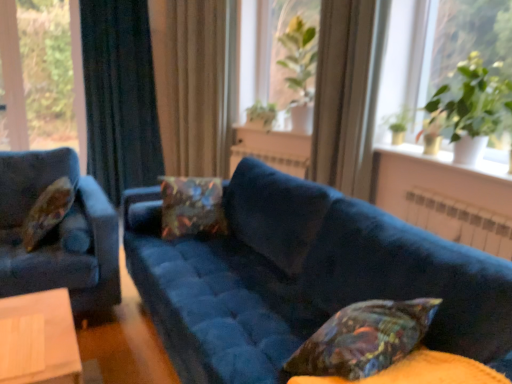
Question: Can we say green leafy plant at upper right lies outside green leafy plant at center, the 3th plant viewed from the back?

Choices:
 (A) no
 (B) yes

Answer: (B)

Question: Is green leafy plant at upper right closer to the viewer compared to green leafy plant at center, the 2th plant from the front?

Choices:
 (A) no
 (B) yes

Answer: (B)

Question: Could you tell me if green leafy plant at upper right is facing green leafy plant at center, the 3th plant when ordered from left to right?

Choices:
 (A) yes
 (B) no

Answer: (B)

Question: Would you say green leafy plant at upper right is a long distance from green leafy plant at center, the 3th plant viewed from the back?

Choices:
 (A) yes
 (B) no

Answer: (B)

Question: Can you confirm if green leafy plant at upper right is positioned to the right of green leafy plant at center, the 2th plant from the front?

Choices:
 (A) no
 (B) yes

Answer: (B)

Question: Does point (136, 221) appear closer or farther from the camera than point (367, 314)?

Choices:
 (A) farther
 (B) closer

Answer: (A)

Question: From the image's perspective, is velvet blue couch at center positioned above or below velvet-like multicolored pillow at lower right, the 1th pillow in the right-to-left sequence?

Choices:
 (A) below
 (B) above

Answer: (A)

Question: Looking at their shapes, would you say velvet blue couch at center is wider or thinner than velvet-like multicolored pillow at lower right, the 1th pillow in the right-to-left sequence?

Choices:
 (A) wide
 (B) thin

Answer: (A)

Question: From a real-world perspective, relative to velvet-like multicolored pillow at lower right, which is the 3th pillow from back to front, is velvet blue couch at center vertically above or below?

Choices:
 (A) below
 (B) above

Answer: (A)

Question: Considering their positions, is dark blue velvet curtain at left, the first curtain in the left-to-right sequence, located in front of or behind green leafy plant at upper left, which is counted as the first plant, starting from the back?

Choices:
 (A) behind
 (B) front

Answer: (B)

Question: Considering the positions of dark blue velvet curtain at left, the first curtain in the left-to-right sequence, and green leafy plant at upper left, which ranks as the fourth plant in right-to-left order, in the image, is dark blue velvet curtain at left, the first curtain in the left-to-right sequence, bigger or smaller than green leafy plant at upper left, which ranks as the fourth plant in right-to-left order,?

Choices:
 (A) small
 (B) big

Answer: (B)

Question: Considering the positions of dark blue velvet curtain at left, the 2th curtain in the right-to-left sequence, and green leafy plant at upper left, marked as the fourth plant in a front-to-back arrangement, in the image, is dark blue velvet curtain at left, the 2th curtain in the right-to-left sequence, taller or shorter than green leafy plant at upper left, marked as the fourth plant in a front-to-back arrangement,?

Choices:
 (A) tall
 (B) short

Answer: (A)

Question: Visually, is dark blue velvet curtain at left, the 2th curtain in the right-to-left sequence, positioned to the left or to the right of green leafy plant at upper left, marked as the fourth plant in a front-to-back arrangement?

Choices:
 (A) left
 (B) right

Answer: (B)

Question: From the image's perspective, relative to white ceramic vase at upper right, is green leafy plant at center, which is the second plant in back-to-front order, above or below?

Choices:
 (A) above
 (B) below

Answer: (A)

Question: In terms of size, does green leafy plant at center, which is the second plant in back-to-front order, appear bigger or smaller than white ceramic vase at upper right?

Choices:
 (A) big
 (B) small

Answer: (A)